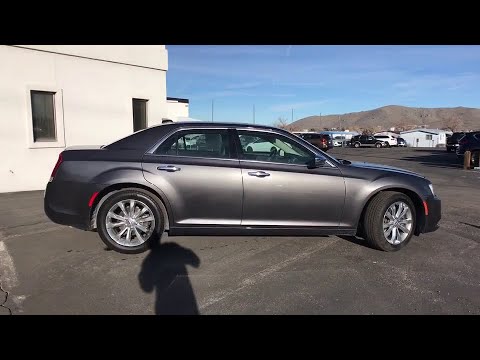
Locate an element on the screen. window is located at coordinates tap(197, 147).